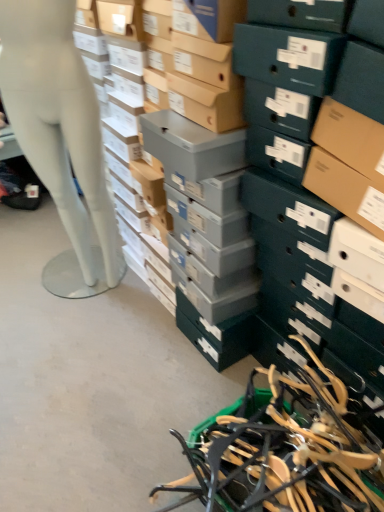
The image size is (384, 512). Identify the location of free region on the left part of matte white mannequin at left. click(x=30, y=295).